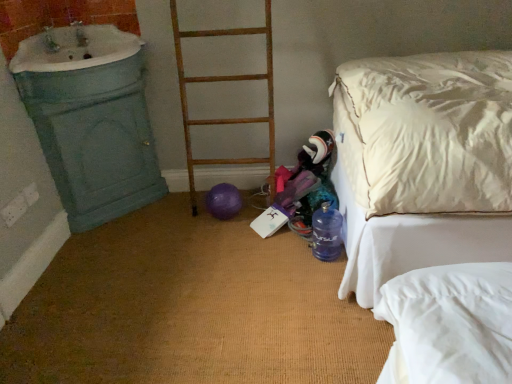
Identify the location of free space in front of translucent blue bottle at lower right. Image resolution: width=512 pixels, height=384 pixels. (321, 273).